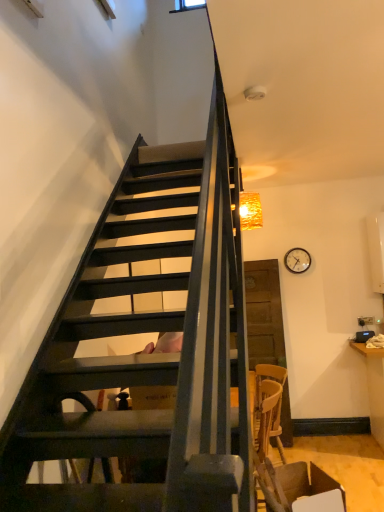
Question: From a real-world perspective, is wooden clock at upper right positioned over crinkled gold lampshade at upper right based on gravity?

Choices:
 (A) no
 (B) yes

Answer: (A)

Question: From the image's perspective, is wooden clock at upper right below crinkled gold lampshade at upper right?

Choices:
 (A) yes
 (B) no

Answer: (A)

Question: Is wooden clock at upper right at the right side of crinkled gold lampshade at upper right?

Choices:
 (A) no
 (B) yes

Answer: (B)

Question: From a real-world perspective, does wooden clock at upper right sit lower than crinkled gold lampshade at upper right?

Choices:
 (A) yes
 (B) no

Answer: (A)

Question: Is wooden clock at upper right taller than crinkled gold lampshade at upper right?

Choices:
 (A) yes
 (B) no

Answer: (B)

Question: Is point (248, 217) closer or farther from the camera than point (339, 487)?

Choices:
 (A) farther
 (B) closer

Answer: (A)

Question: Looking at their shapes, would you say crinkled gold lampshade at upper right is wider or thinner than brown leather armchair at lower right?

Choices:
 (A) thin
 (B) wide

Answer: (A)

Question: From the image's perspective, is crinkled gold lampshade at upper right above or below brown leather armchair at lower right?

Choices:
 (A) above
 (B) below

Answer: (A)

Question: Is crinkled gold lampshade at upper right taller or shorter than brown leather armchair at lower right?

Choices:
 (A) short
 (B) tall

Answer: (B)

Question: Based on their positions, is crinkled gold lampshade at upper right located to the left or right of wooden clock at upper right?

Choices:
 (A) right
 (B) left

Answer: (B)

Question: Considering the positions of point (256, 218) and point (309, 266), is point (256, 218) closer or farther from the camera than point (309, 266)?

Choices:
 (A) closer
 (B) farther

Answer: (A)

Question: Is crinkled gold lampshade at upper right wider or thinner than wooden clock at upper right?

Choices:
 (A) thin
 (B) wide

Answer: (B)

Question: Is crinkled gold lampshade at upper right situated inside wooden clock at upper right or outside?

Choices:
 (A) outside
 (B) inside

Answer: (A)

Question: From a real-world perspective, is wooden clock at upper right above or below crinkled gold lampshade at upper right?

Choices:
 (A) above
 (B) below

Answer: (B)

Question: From the image's perspective, is wooden clock at upper right located above or below crinkled gold lampshade at upper right?

Choices:
 (A) above
 (B) below

Answer: (B)